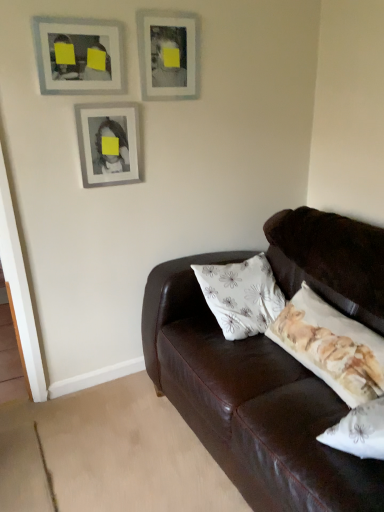
Question: Is matte silver picture frame at upper center, which is the third picture frame in left-to-right order, aimed at matte silver picture frame at center, which is counted as the second picture frame, starting from the right?

Choices:
 (A) yes
 (B) no

Answer: (B)

Question: Could matte silver picture frame at center, which is counted as the second picture frame, starting from the right, be considered to be inside matte silver picture frame at upper center, which is the third picture frame in left-to-right order?

Choices:
 (A) yes
 (B) no

Answer: (B)

Question: From the image's perspective, does matte silver picture frame at upper center, which is the 1th picture frame from right to left, appear lower than matte silver picture frame at center, which is counted as the second picture frame, starting from the left?

Choices:
 (A) yes
 (B) no

Answer: (B)

Question: Considering the relative sizes of matte silver picture frame at upper center, which is the 1th picture frame from right to left, and matte silver picture frame at center, which is counted as the second picture frame, starting from the left, in the image provided, is matte silver picture frame at upper center, which is the 1th picture frame from right to left, thinner than matte silver picture frame at center, which is counted as the second picture frame, starting from the left,?

Choices:
 (A) yes
 (B) no

Answer: (A)

Question: Considering the relative sizes of matte silver picture frame at upper center, which is the 1th picture frame from right to left, and matte silver picture frame at center, which is counted as the second picture frame, starting from the left, in the image provided, is matte silver picture frame at upper center, which is the 1th picture frame from right to left, shorter than matte silver picture frame at center, which is counted as the second picture frame, starting from the left,?

Choices:
 (A) no
 (B) yes

Answer: (B)

Question: Is point (145, 72) positioned closer to the camera than point (52, 17)?

Choices:
 (A) farther
 (B) closer

Answer: (A)

Question: Choose the correct answer: Is matte silver picture frame at upper center, which is the third picture frame in left-to-right order, inside matte gray picture frame at upper left, positioned as the first picture frame in left-to-right order, or outside it?

Choices:
 (A) outside
 (B) inside

Answer: (A)

Question: Visually, is matte silver picture frame at upper center, which is the third picture frame in left-to-right order, positioned to the left or to the right of matte gray picture frame at upper left, positioned as the first picture frame in left-to-right order?

Choices:
 (A) right
 (B) left

Answer: (A)

Question: Is matte silver picture frame at upper center, which is the 1th picture frame from right to left, taller or shorter than matte gray picture frame at upper left, positioned as the first picture frame in left-to-right order?

Choices:
 (A) tall
 (B) short

Answer: (A)

Question: From their relative heights in the image, would you say matte silver picture frame at center, which is counted as the second picture frame, starting from the right, is taller or shorter than matte gray picture frame at upper left, positioned as the first picture frame in left-to-right order?

Choices:
 (A) tall
 (B) short

Answer: (A)

Question: Which is correct: matte silver picture frame at center, which is counted as the second picture frame, starting from the right, is inside matte gray picture frame at upper left, which ranks as the 3th picture frame in right-to-left order, or outside of it?

Choices:
 (A) inside
 (B) outside

Answer: (B)

Question: Looking at their shapes, would you say matte silver picture frame at center, which is counted as the second picture frame, starting from the left, is wider or thinner than matte gray picture frame at upper left, which ranks as the 3th picture frame in right-to-left order?

Choices:
 (A) wide
 (B) thin

Answer: (A)

Question: Is matte silver picture frame at center, which is counted as the second picture frame, starting from the left, to the left or to the right of matte gray picture frame at upper left, which ranks as the 3th picture frame in right-to-left order, in the image?

Choices:
 (A) left
 (B) right

Answer: (B)

Question: Visually, is matte gray picture frame at upper left, positioned as the first picture frame in left-to-right order, positioned to the left or to the right of matte silver picture frame at upper center, which is the 1th picture frame from right to left?

Choices:
 (A) left
 (B) right

Answer: (A)

Question: From a real-world perspective, is matte gray picture frame at upper left, positioned as the first picture frame in left-to-right order, above or below matte silver picture frame at upper center, which is the 1th picture frame from right to left?

Choices:
 (A) below
 (B) above

Answer: (A)